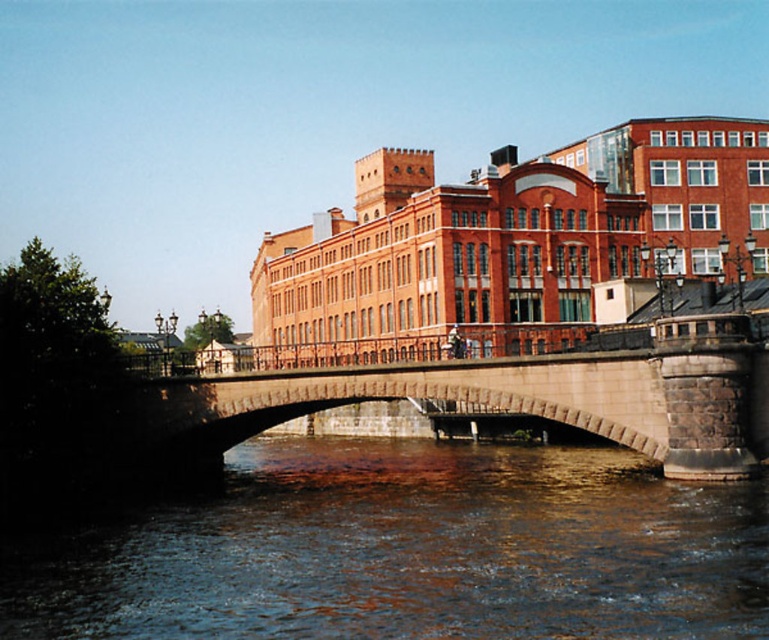
Question: Is brown stone water at center behind stone bridge at center?

Choices:
 (A) no
 (B) yes

Answer: (A)

Question: Is brown stone water at center smaller than stone bridge at center?

Choices:
 (A) no
 (B) yes

Answer: (A)

Question: Which object is closer to the camera taking this photo?

Choices:
 (A) brown stone water at center
 (B) stone bridge at center

Answer: (A)

Question: Does brown stone water at center appear on the right side of stone bridge at center?

Choices:
 (A) yes
 (B) no

Answer: (B)

Question: Among these points, which one is farthest from the camera?

Choices:
 (A) click(741, 502)
 (B) click(155, 422)

Answer: (B)